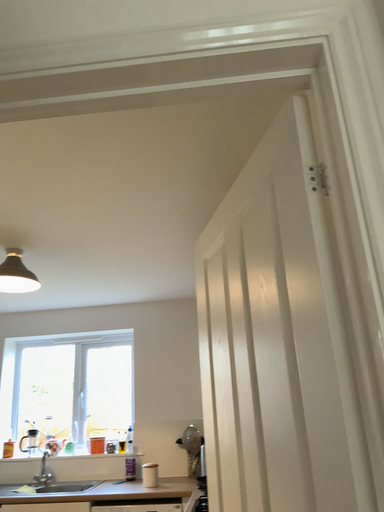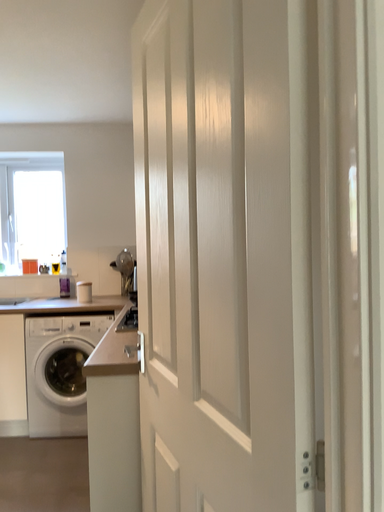
Question: Which way did the camera rotate in the video?

Choices:
 (A) rotated left
 (B) rotated right

Answer: (B)